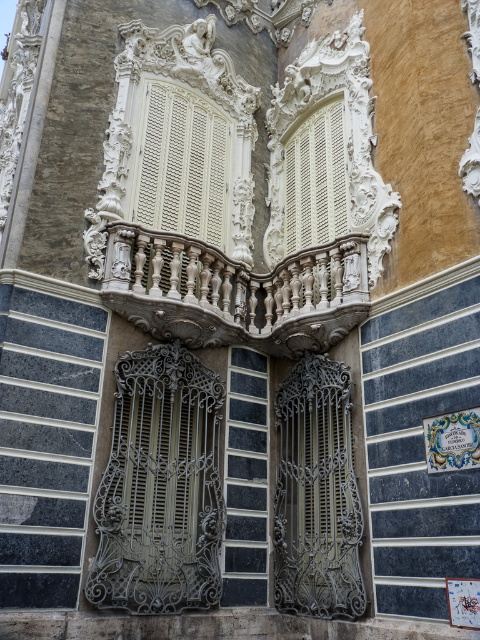
Is white carved wood balcony at center taller than white textured shutters at center?

Correct, white carved wood balcony at center is much taller as white textured shutters at center.

Between white carved wood balcony at center and white textured shutters at center, which one has less height?

white textured shutters at center is shorter.

Is point (200, 192) behind point (286, 157)?

No.

This screenshot has width=480, height=640. I want to click on white carved wood balcony at center, so click(182, 164).

Can you confirm if white carved wood balustrade at center is positioned to the left of white textured shutters at center?

Indeed, white carved wood balustrade at center is positioned on the left side of white textured shutters at center.

Can you confirm if white carved wood balustrade at center is taller than white textured shutters at center?

No.

The image size is (480, 640). Describe the element at coordinates (235, 291) in the screenshot. I see `white carved wood balustrade at center` at that location.

Find the location of a particular element. The width and height of the screenshot is (480, 640). white carved wood balustrade at center is located at coordinates (235, 291).

Which is more to the left, white carved wood balustrade at center or black glass window at center?

white carved wood balustrade at center

Who is more distant from viewer, (171,291) or (264,468)?

Positioned behind is point (264,468).

Measure the distance between point (133, 284) and camera.

A distance of 32.24 meters exists between point (133, 284) and camera.

The image size is (480, 640). I want to click on white carved wood balustrade at center, so click(x=235, y=291).